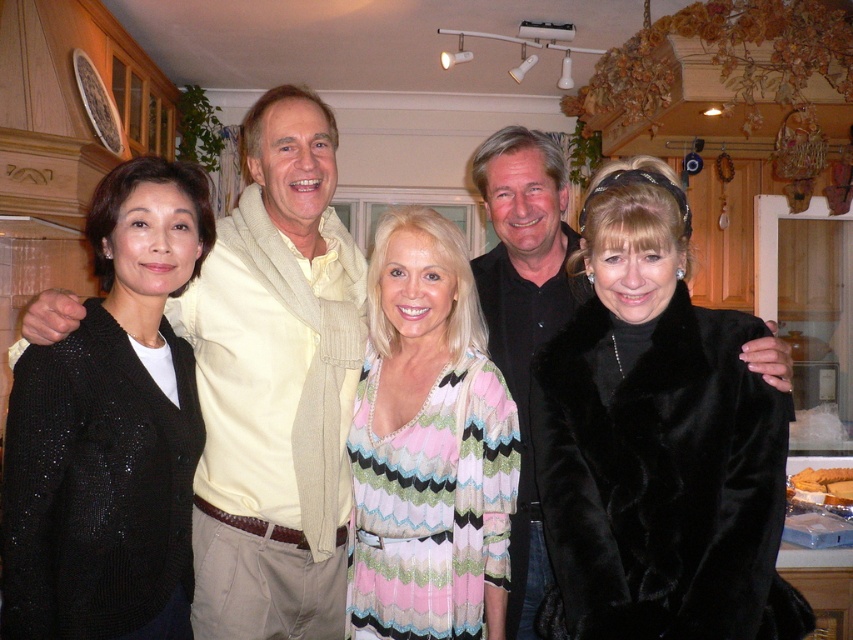
You are a photographer setting up a camera to capture this group photo. You need to adjust the focus so that both the black sequined cardigan at left and the striped knit dress at center are in clear view. Considering their heights, which object should you focus on first to ensure proper alignment?

The black sequined cardigan at left is much taller than the striped knit dress at center, so you should focus on the black sequined cardigan at left first to ensure proper alignment.

You are organizing a photo shoot and need to ensure that the black sequined cardigan at left and the black velvet shirt at center are visible in the frame. Based on their sizes, which one might require more careful positioning to avoid being cropped out?

The black velvet shirt at center requires more careful positioning because it occupies more space than the black sequined cardigan at left, making it more likely to be cropped if not framed properly.

You are standing in front of the group photo and want to point out two specific points. The first point is at coordinates point (x=24, y=612) and the second is at point (x=519, y=138). Which of these two points is nearer to you?

Point (x=24, y=612) is closer to the viewer than point (x=519, y=138).